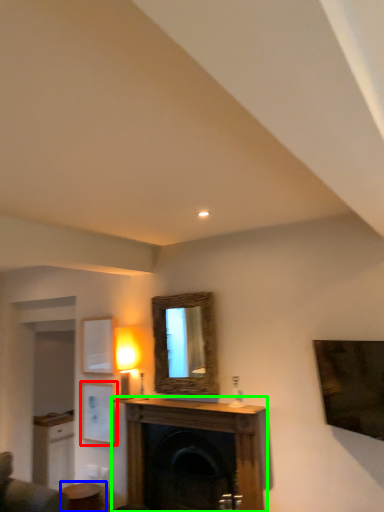
Question: Based on their relative distances, which object is nearer to picture frame (highlighted by a red box)? Choose from table (highlighted by a blue box) and fireplace (highlighted by a green box).

Choices:
 (A) table
 (B) fireplace

Answer: (A)